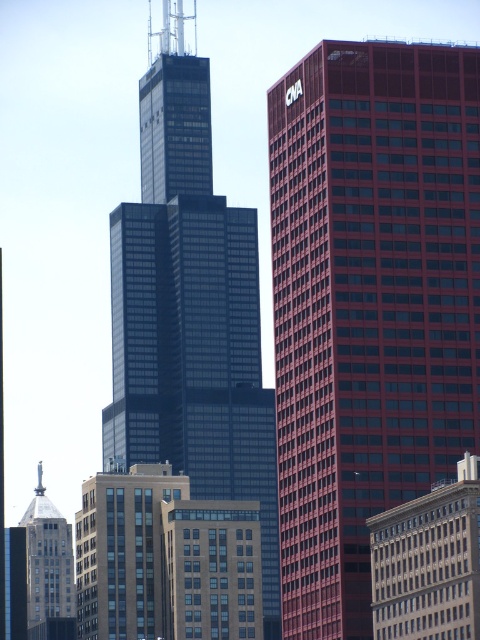
You are a photographer positioned in front of the two skyscrapers. You want to capture a photo where the smooth glass building at right and the dark glass skyscraper at center are both in focus. Given that your camera can only focus on objects within a 10 meter depth range, can you achieve this?

The smooth glass building at right is closer to the viewer than the dark glass skyscraper at center. Since the camera can only focus on objects within a 10 meter depth range, you need to know the exact distance between them to determine if they can both be in focus. The provided information does not specify the actual distances, so it is impossible to confirm if they fall within the 10 meter range.

You are a drone operator flying a drone that can only move horizontally. You need to capture a photo of the brick building at lower right and the silver metallic statue at upper left. Can you fly your drone in a straight line between them without any obstruction?

The brick building at lower right is closer to the viewer than the silver metallic statue at upper left, so the drone can fly in a straight line between them without obstruction because the closer brick building will not block the path to the statue behind it.

You are a city planner analyzing the skyline. You need to determine which of the two buildings, the dark glass skyscraper at center or the brick building at lower right, requires more maintenance due to its size. Which one would you prioritize?

The dark glass skyscraper at center is bigger than the brick building at lower right, so it would require more maintenance and should be prioritized.